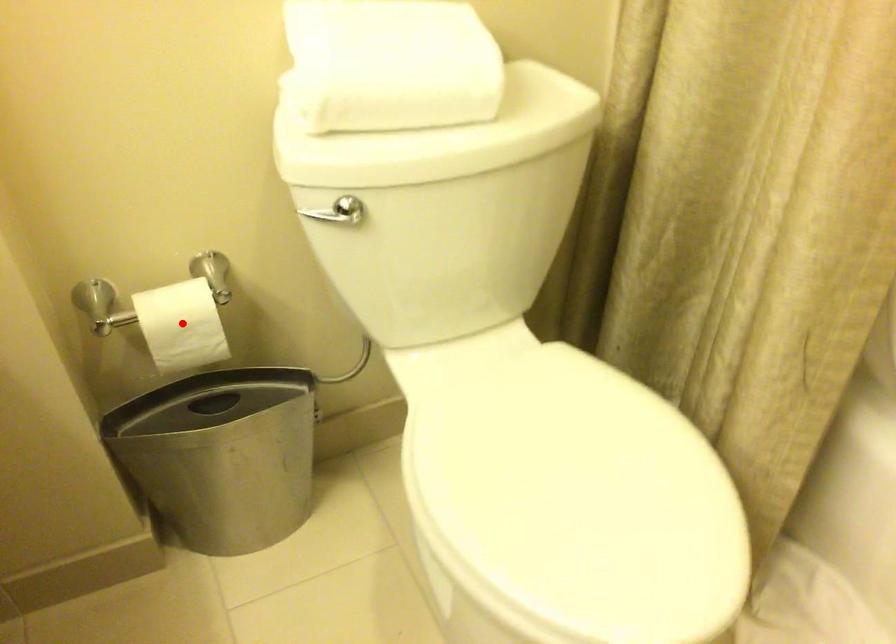
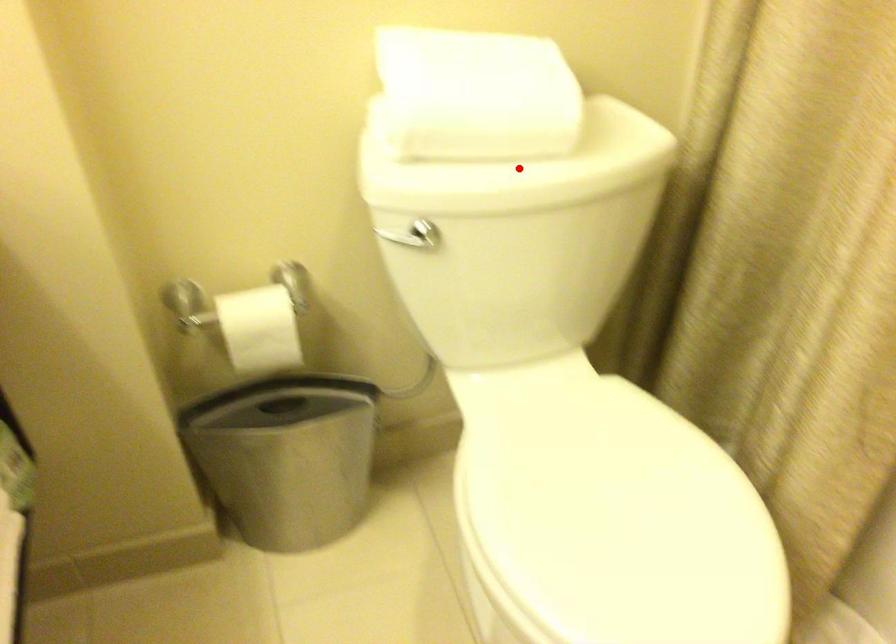
I am providing you with two images of the same scene from different viewpoints. A red point is marked on the first image and another point is marked on the second image. Does the point marked in image1 correspond to the same location as the one in image2?

No